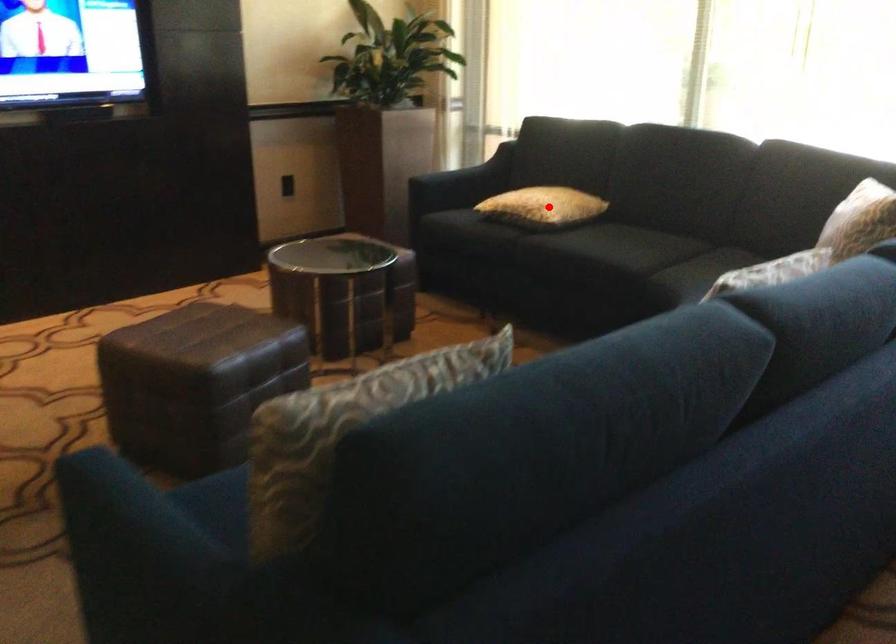
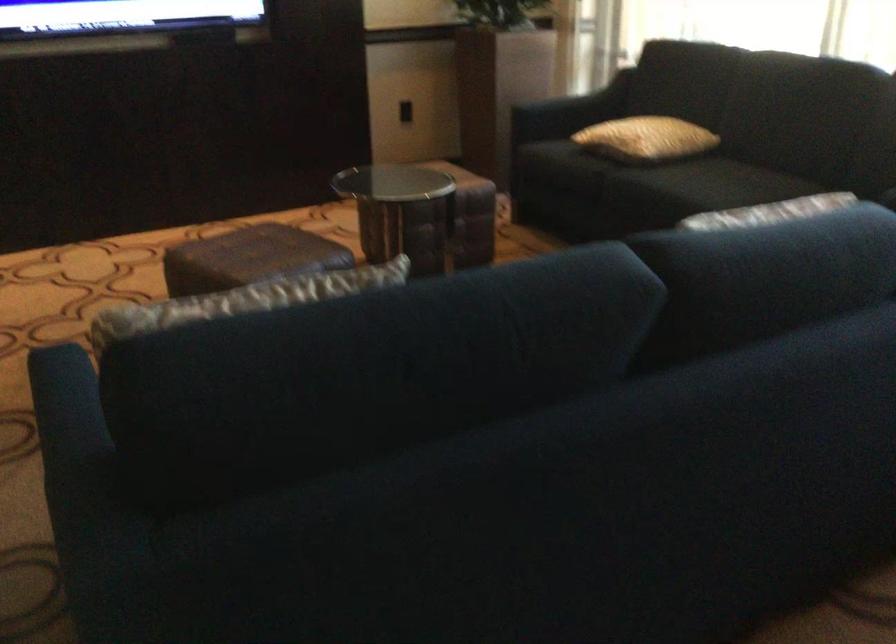
In the second image, find the point that corresponds to the highlighted location in the first image.

(645, 138)